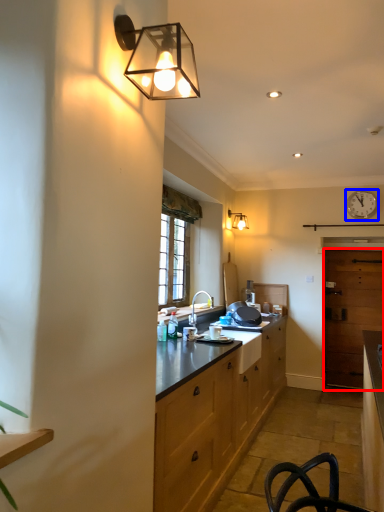
Question: Which object appears closest to the camera in this image, glass door (highlighted by a red box) or clock (highlighted by a blue box)?

Choices:
 (A) glass door
 (B) clock

Answer: (B)